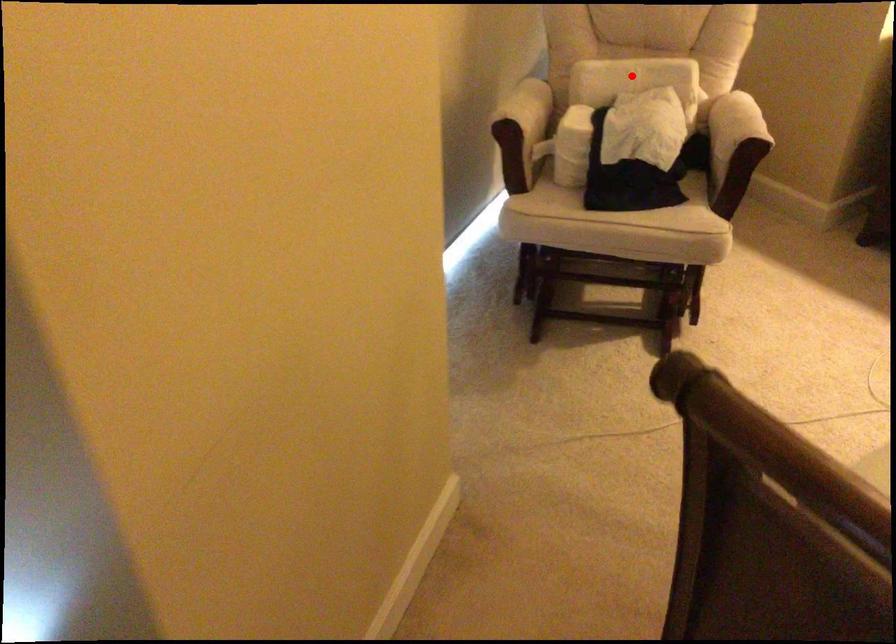
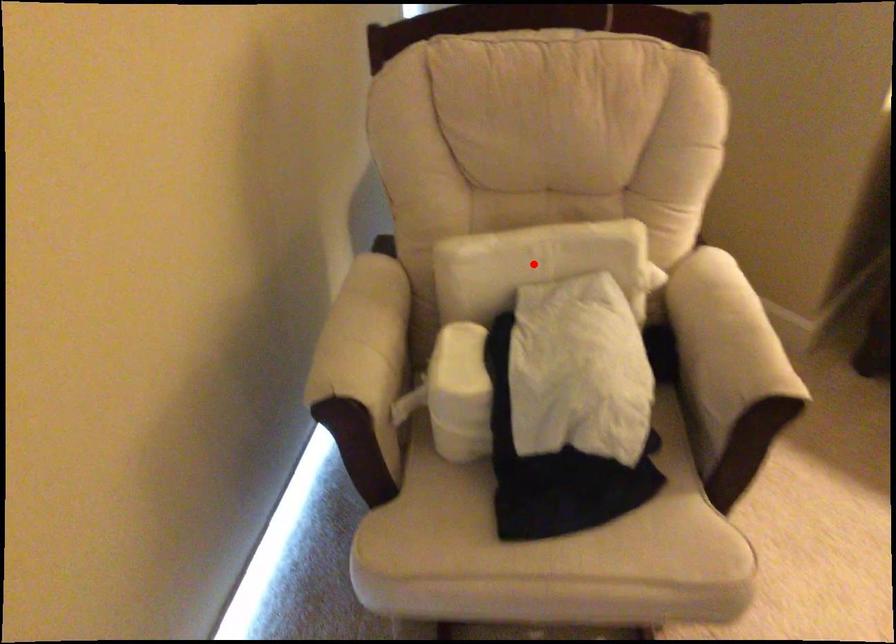
I am providing you with two images of the same scene from different viewpoints. A red point is marked on the first image and another point is marked on the second image. Does the point marked in image1 correspond to the same location as the one in image2?

Yes